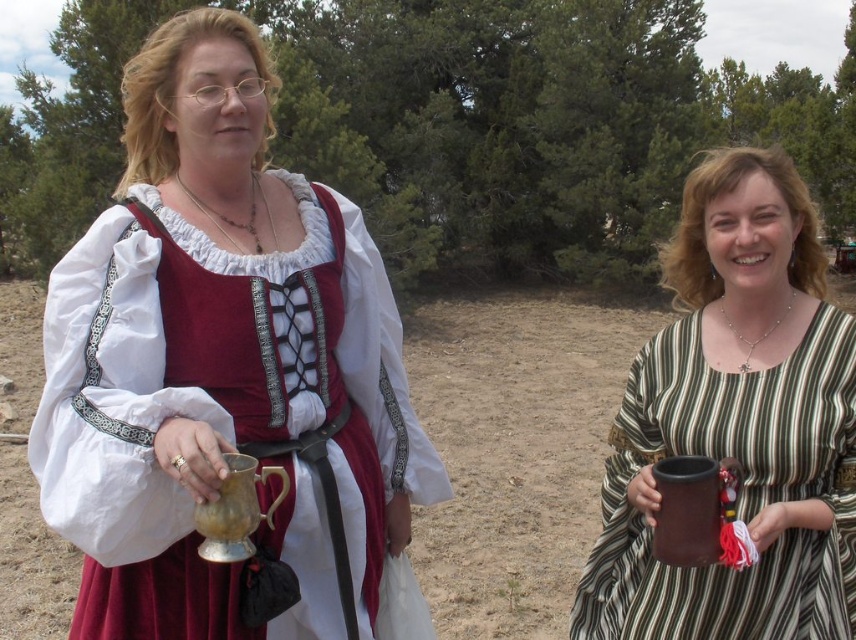
Is metallic gold cup at center taller than brown sandy dirt at center?

Incorrect, metallic gold cup at center's height is not larger of brown sandy dirt at center's.

Does point (108, 524) come farther from viewer compared to point (568, 401)?

No, (108, 524) is closer to viewer.

Describe the element at coordinates (223, 365) in the screenshot. This screenshot has width=856, height=640. I see `metallic gold cup at center` at that location.

Find the location of a particular element. The image size is (856, 640). metallic gold cup at center is located at coordinates (223, 365).

Can you confirm if brown matte mug at upper right is wider than brown sandy dirt at center?

Incorrect, brown matte mug at upper right's width does not surpass brown sandy dirt at center's.

Can you confirm if brown matte mug at upper right is taller than brown sandy dirt at center?

In fact, brown matte mug at upper right may be shorter than brown sandy dirt at center.

Is point (724, 221) farther from camera compared to point (516, 506)?

No, it is in front of (516, 506).

Find the location of a particular element. This screenshot has width=856, height=640. brown matte mug at upper right is located at coordinates (736, 422).

Between metallic gold cup at center and brown matte mug at upper right, which one is positioned lower?

brown matte mug at upper right is below.

Is metallic gold cup at center thinner than brown matte mug at upper right?

In fact, metallic gold cup at center might be wider than brown matte mug at upper right.

The height and width of the screenshot is (640, 856). What do you see at coordinates (223, 365) in the screenshot? I see `metallic gold cup at center` at bounding box center [223, 365].

Where is `metallic gold cup at center`? metallic gold cup at center is located at coordinates (223, 365).